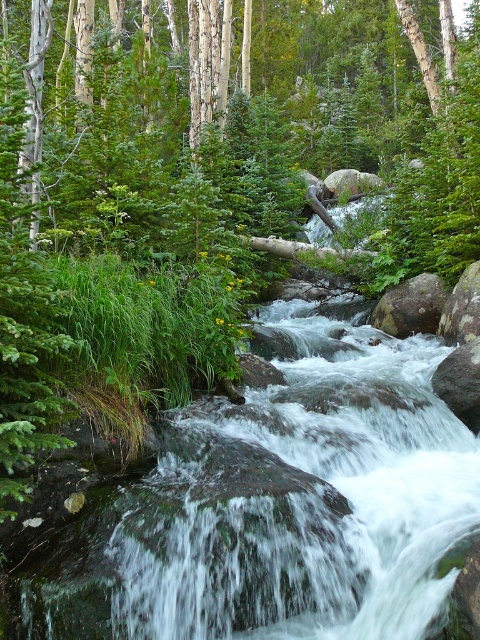
Question: Which point is farther from the camera taking this photo?

Choices:
 (A) (96, 588)
 (B) (394, 317)

Answer: (B)

Question: Can you confirm if clear water at center is positioned below smooth gray rock at center?

Choices:
 (A) yes
 (B) no

Answer: (A)

Question: Which point is closer to the camera?

Choices:
 (A) clear water at center
 (B) smooth gray rock at center

Answer: (A)

Question: Where is clear water at center located in relation to smooth gray rock at center in the image?

Choices:
 (A) above
 (B) below

Answer: (B)

Question: Can you confirm if clear water at center is positioned to the right of smooth gray rock at center?

Choices:
 (A) yes
 (B) no

Answer: (B)

Question: Which point is closer to the camera?

Choices:
 (A) (382, 321)
 (B) (360, 392)

Answer: (B)